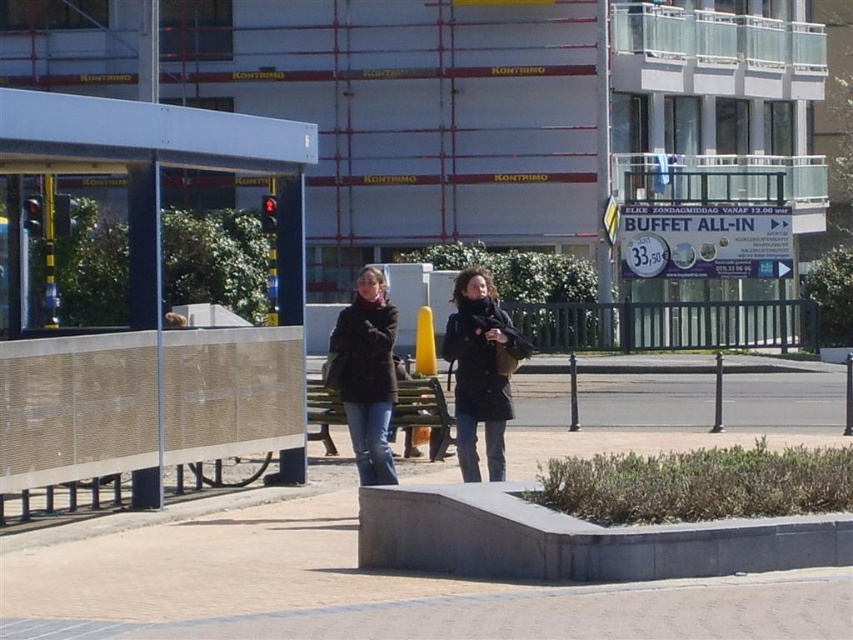
Does matte black coat at center appear over wooden park bench at center?

Indeed, matte black coat at center is positioned over wooden park bench at center.

In the scene shown: Measure the distance between matte black coat at center and camera.

41.44 feet

The image size is (853, 640). What are the coordinates of `matte black coat at center` in the screenshot? It's located at (480, 371).

Is metallic silver bus stop at left taller than dark brown leather jacket at center?

Incorrect, metallic silver bus stop at left's height is not larger of dark brown leather jacket at center's.

Who is taller, metallic silver bus stop at left or dark brown leather jacket at center?

With more height is dark brown leather jacket at center.

Between point (140, 416) and point (375, 417), which one is positioned behind?

Point (140, 416)

The image size is (853, 640). Find the location of `metallic silver bus stop at left`. metallic silver bus stop at left is located at coordinates (140, 291).

Based on the photo, which is above, metallic silver bus stop at left or wooden park bench at center?

A: metallic silver bus stop at left

Measure the distance between metallic silver bus stop at left and wooden park bench at center.

metallic silver bus stop at left is 3.95 meters away from wooden park bench at center.

Between point (62, 376) and point (431, 449), which one is positioned in front?

Point (62, 376) is more forward.

Where is `metallic silver bus stop at left`? Image resolution: width=853 pixels, height=640 pixels. metallic silver bus stop at left is located at coordinates (140, 291).